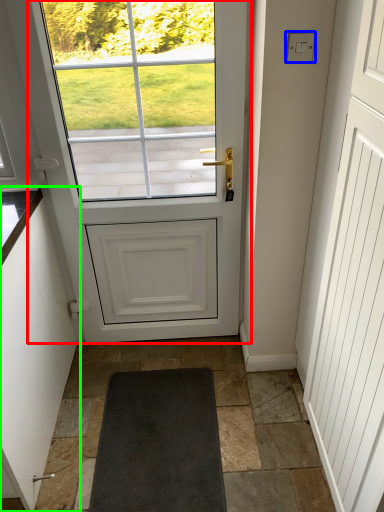
Question: Which is farther away from door (highlighted by a red box)? lock (highlighted by a blue box) or cabinetry (highlighted by a green box)?

Choices:
 (A) lock
 (B) cabinetry

Answer: (A)